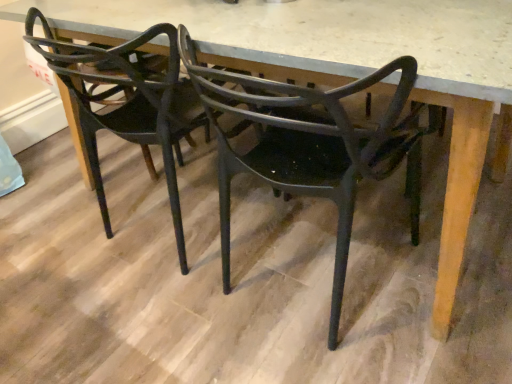
Question: From a real-world perspective, is matte black chair at center, acting as the 1th chair starting from the left, located beneath matte black chair at center, the 1th chair in the right-to-left sequence?

Choices:
 (A) no
 (B) yes

Answer: (A)

Question: Considering the relative sizes of matte black chair at center, which appears as the second chair when viewed from the right, and matte black chair at center, the second chair from the left, in the image provided, is matte black chair at center, which appears as the second chair when viewed from the right, wider than matte black chair at center, the second chair from the left,?

Choices:
 (A) yes
 (B) no

Answer: (A)

Question: Is matte black chair at center, acting as the 1th chair starting from the left, touching matte black chair at center, the second chair from the left?

Choices:
 (A) no
 (B) yes

Answer: (A)

Question: Can you confirm if matte black chair at center, which appears as the second chair when viewed from the right, is taller than matte black chair at center, the 1th chair in the right-to-left sequence?

Choices:
 (A) no
 (B) yes

Answer: (A)

Question: Is matte black chair at center, which appears as the second chair when viewed from the right, positioned beyond the bounds of matte black chair at center, the 1th chair in the right-to-left sequence?

Choices:
 (A) yes
 (B) no

Answer: (A)

Question: From a real-world perspective, is matte black chair at center, which appears as the second chair when viewed from the right, on top of matte black chair at center, the second chair from the left?

Choices:
 (A) no
 (B) yes

Answer: (B)

Question: Is matte black chair at center, the second chair from the left, bigger than matte black chair at center, acting as the 1th chair starting from the left?

Choices:
 (A) no
 (B) yes

Answer: (A)

Question: Is matte black chair at center, the 1th chair in the right-to-left sequence, next to matte black chair at center, acting as the 1th chair starting from the left?

Choices:
 (A) yes
 (B) no

Answer: (B)

Question: From a real-world perspective, is matte black chair at center, the second chair from the left, beneath matte black chair at center, which appears as the second chair when viewed from the right?

Choices:
 (A) yes
 (B) no

Answer: (A)

Question: From a real-world perspective, is matte black chair at center, the second chair from the left, on matte black chair at center, acting as the 1th chair starting from the left?

Choices:
 (A) yes
 (B) no

Answer: (B)

Question: Is matte black chair at center, the second chair from the left, thinner than matte black chair at center, acting as the 1th chair starting from the left?

Choices:
 (A) no
 (B) yes

Answer: (B)

Question: From the image's perspective, is matte black chair at center, the second chair from the left, below matte black chair at center, acting as the 1th chair starting from the left?

Choices:
 (A) yes
 (B) no

Answer: (A)

Question: From a real-world perspective, relative to matte black chair at center, the 1th chair in the right-to-left sequence, is matte black chair at center, acting as the 1th chair starting from the left, vertically above or below?

Choices:
 (A) below
 (B) above

Answer: (B)